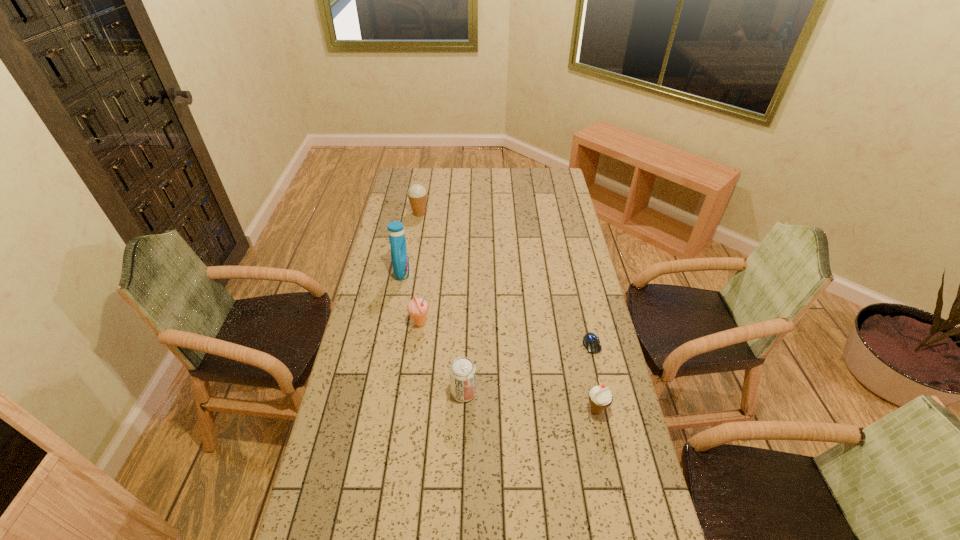
Identify the location of vacant space located on the back of the fourth nearest object. Image resolution: width=960 pixels, height=540 pixels. (426, 280).

Where is `vacant space situated 0.070m on the back of the soda can`? The height and width of the screenshot is (540, 960). vacant space situated 0.070m on the back of the soda can is located at coordinates (465, 364).

The image size is (960, 540). In order to click on free space located 0.320m on the front of the nearest icecream in this screenshot , I will do click(x=623, y=535).

At what (x,y) coordinates should I click in order to perform the action: click on free space located on the button side of the computer mouse. Please return your answer as a coordinate pair (x, y). The width and height of the screenshot is (960, 540). Looking at the image, I should click on (619, 464).

Where is `detergent that is positioned at the left edge`? detergent that is positioned at the left edge is located at coordinates (399, 253).

In order to click on icecream present at the left edge in this screenshot , I will do `click(417, 194)`.

Identify the location of icecream that is positioned at the right edge. (600, 397).

In order to click on computer mouse that is at the right edge in this screenshot , I will do `click(591, 342)`.

Where is `vacant region at the far edge of the desktop`? The width and height of the screenshot is (960, 540). vacant region at the far edge of the desktop is located at coordinates (473, 190).

I want to click on vacant area at the left edge of the desktop, so click(309, 509).